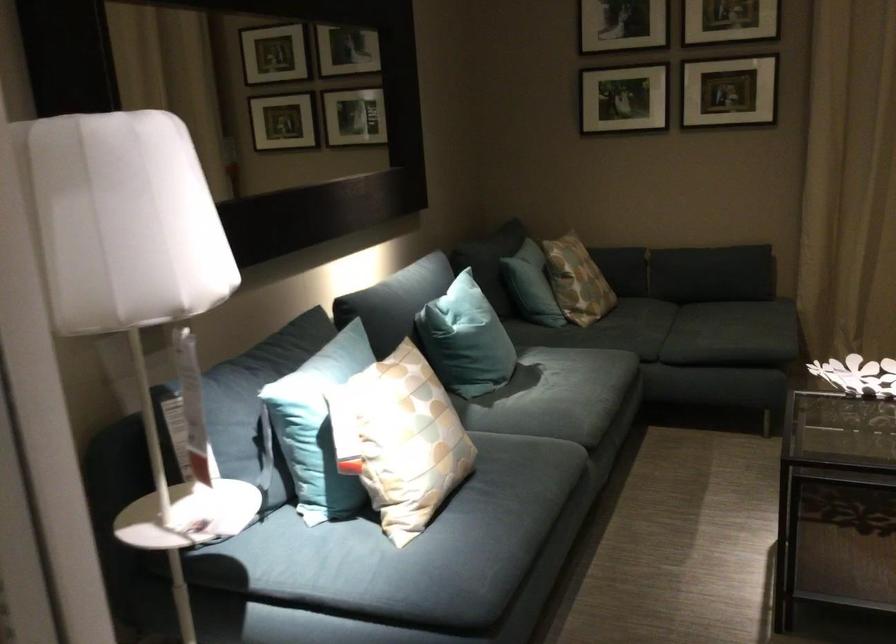
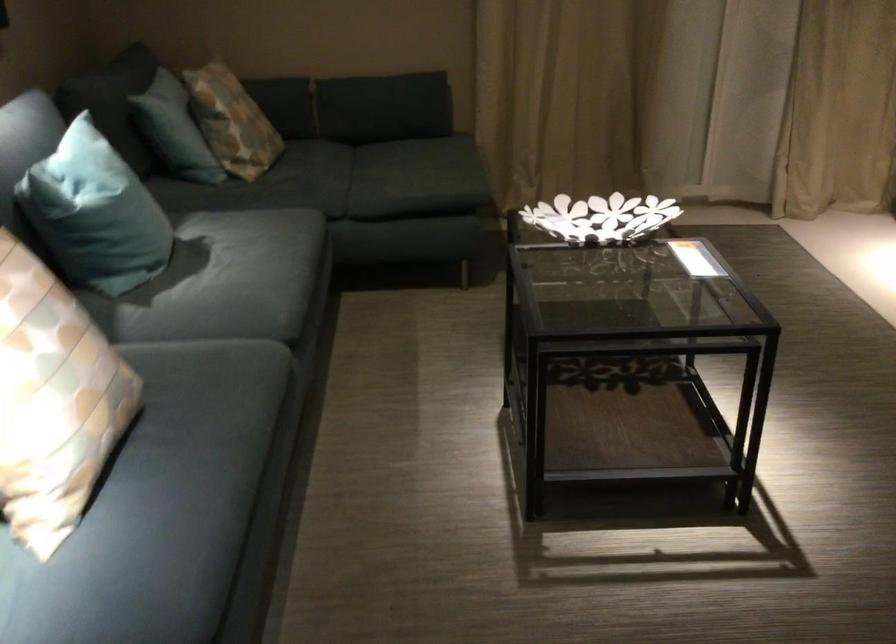
Question: The camera is either moving clockwise (left) or counter-clockwise (right) around the object. The first image is from the beginning of the video and the second image is from the end. Is the camera moving left or right when shooting the video?

Choices:
 (A) Left
 (B) Right

Answer: (A)